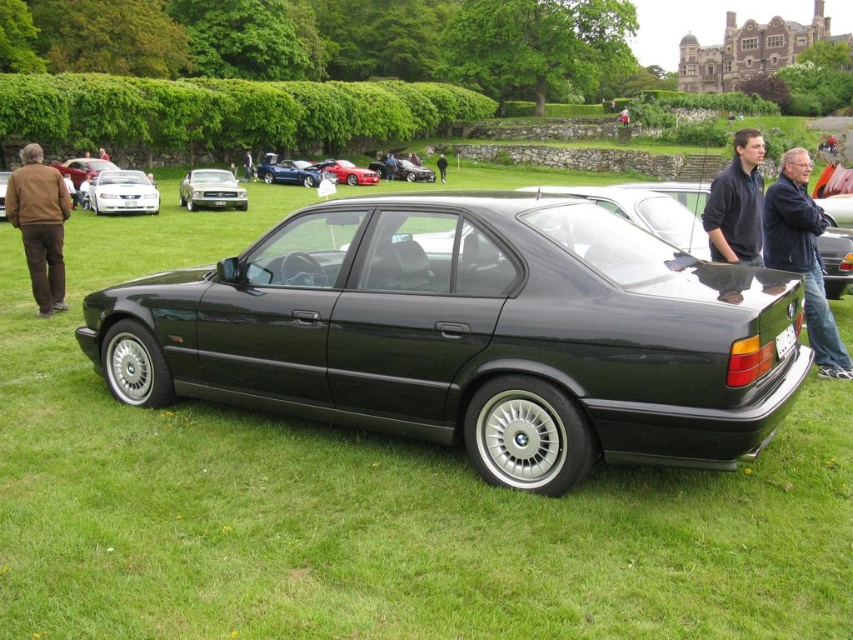
You are a photographer at the car show and want to take a closeup shot of the dark blue sweater at center and the black leather jacket at center. Which one should you focus on if you want to capture more details in the same photo?

The dark blue sweater at center is bigger than the black leather jacket at center, so focusing on the dark blue sweater at center would allow you to capture more details in the same photo since it occupies a larger area in the frame.

You are a photographer planning to take a wide shot of the car show. You notice two cars in the scene, the shiny silver car at center and the shiny blue car at center. Given that you want to ensure both cars are fully visible in your frame, which car requires a wider angle to accommodate its size?

The shiny silver car at center requires a wider angle because its width surpasses that of the shiny blue car at center, necessitating more space in the frame to fully capture it.

You are at a car show and see two people wearing dark blue sweater at center and black leather jacket at center. Which one is positioned more to the right side?

The dark blue sweater at center is positioned to the right of the black leather jacket at center, so the dark blue sweater at center is more to the right side.